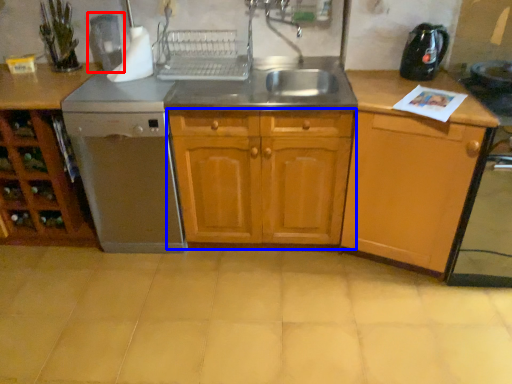
Question: Which object appears farthest to the camera in this image, coffee machine (highlighted by a red box) or cabinetry (highlighted by a blue box)?

Choices:
 (A) coffee machine
 (B) cabinetry

Answer: (A)